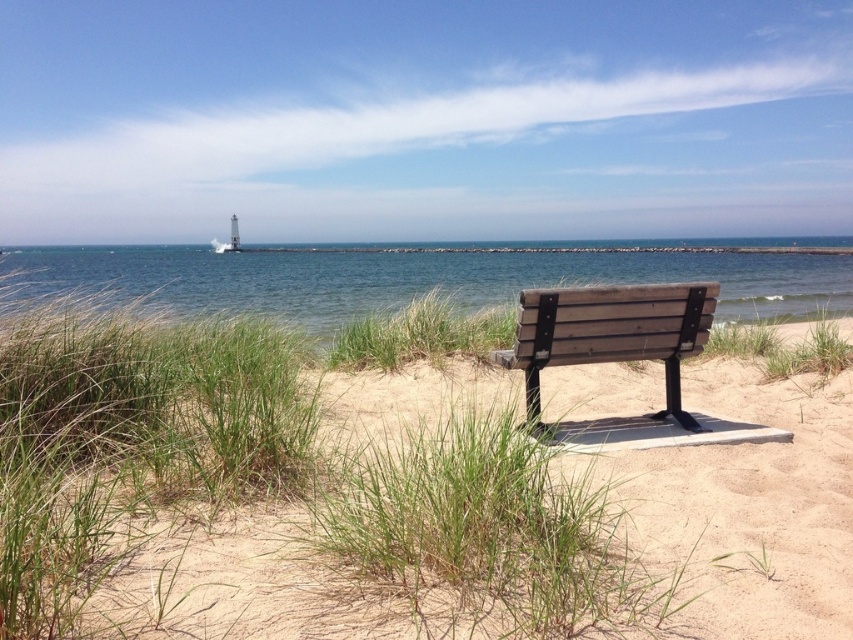
Question: Does clear blue water at center appear on the left side of wooden bench at center?

Choices:
 (A) yes
 (B) no

Answer: (A)

Question: Is green grass at center smaller than wooden bench at center?

Choices:
 (A) yes
 (B) no

Answer: (B)

Question: Among these objects, which one is nearest to the camera?

Choices:
 (A) clear blue water at center
 (B) wooden bench at center

Answer: (B)

Question: Which point appears farthest from the camera in this image?

Choices:
 (A) (141, 544)
 (B) (54, 257)
 (C) (676, 385)

Answer: (B)

Question: Can you confirm if green grass at center is thinner than wooden bench at center?

Choices:
 (A) no
 (B) yes

Answer: (A)

Question: Which of the following is the closest to the observer?

Choices:
 (A) [300, 289]
 (B) [581, 307]
 (C) [126, 600]

Answer: (C)